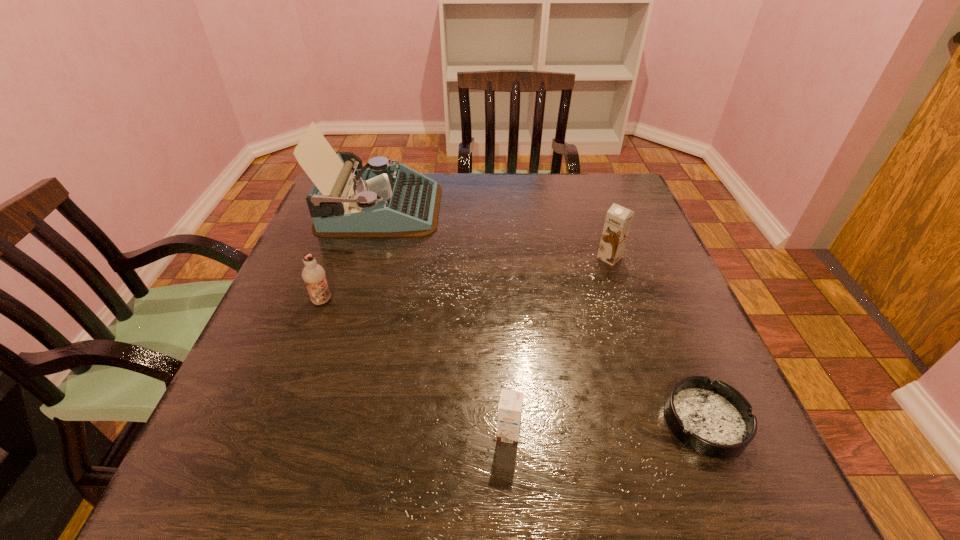
You are a GUI agent. You are given a task and a screenshot of the screen. Output one action in this format:
    pyautogui.click(x=<x>, y=<y>)
    Task: Click on the free space that satisfies the following two spatial constraints: 1. on the back side of the rightmost chocolate milk; 2. on the left side of the nearest chocolate milk
    Image resolution: width=960 pixels, height=540 pixels.
    Given the screenshot: What is the action you would take?
    pyautogui.click(x=499, y=258)

You are a GUI agent. You are given a task and a screenshot of the screen. Output one action in this format:
    pyautogui.click(x=<x>, y=<y>)
    Task: Click on the vacant space that satisfies the following two spatial constraints: 1. on the typing side of the tallest object; 2. on the back side of the fourth nearest object
    
    Given the screenshot: What is the action you would take?
    pyautogui.click(x=366, y=258)

Locate an element on the screen. The image size is (960, 540). blank space that satisfies the following two spatial constraints: 1. on the typing side of the shortest object; 2. on the right side of the farthest object is located at coordinates (316, 422).

At what (x,y) coordinates should I click in order to perform the action: click on vacant position in the image that satisfies the following two spatial constraints: 1. on the typing side of the farthest object; 2. on the front side of the third nearest object. Please return your answer as a coordinate pair (x, y). This screenshot has height=540, width=960. Looking at the image, I should click on (352, 301).

Where is `free location that satisfies the following two spatial constraints: 1. on the typing side of the tallest object; 2. on the left side of the farthest chocolate milk`? The height and width of the screenshot is (540, 960). free location that satisfies the following two spatial constraints: 1. on the typing side of the tallest object; 2. on the left side of the farthest chocolate milk is located at coordinates (366, 258).